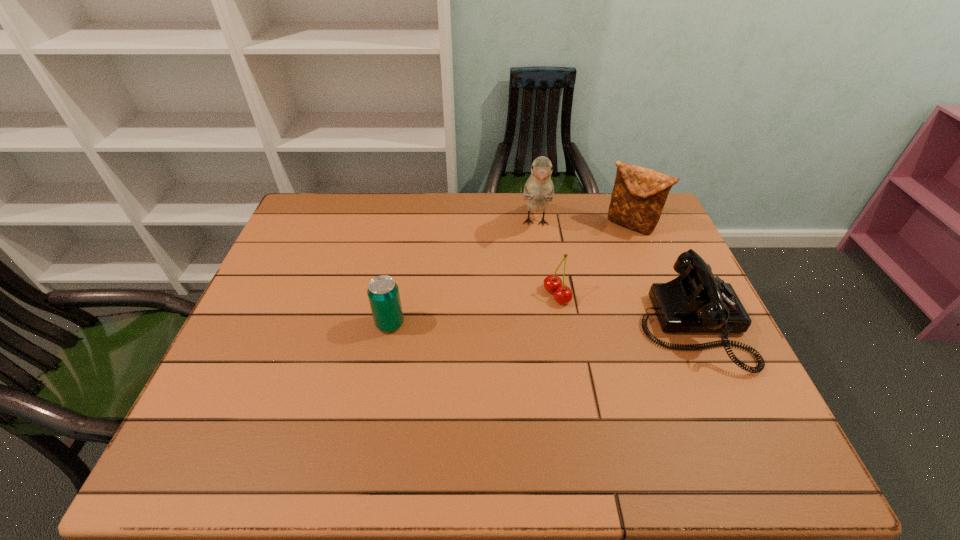
Locate an element on the screen. vacant space located at the face of the tallest object is located at coordinates (537, 255).

What are the coordinates of `vacant space located at the face of the tallest object` in the screenshot? It's located at (535, 299).

This screenshot has width=960, height=540. I want to click on vacant space located with the stems of the cherry pointing upwards, so click(x=452, y=346).

The width and height of the screenshot is (960, 540). In order to click on free space located 0.160m with the stems of the cherry pointing upwards in this screenshot , I will do `click(496, 325)`.

At what (x,y) coordinates should I click in order to perform the action: click on free space located 0.050m with the stems of the cherry pointing upwards. Please return your answer as a coordinate pair (x, y). This screenshot has height=540, width=960. Looking at the image, I should click on (532, 308).

You are a GUI agent. You are given a task and a screenshot of the screen. Output one action in this format:
    pyautogui.click(x=<x>, y=<y>)
    Task: Click on the clutch bag present at the far edge
    The height and width of the screenshot is (540, 960).
    Given the screenshot: What is the action you would take?
    pyautogui.click(x=639, y=194)

Locate an element on the screen. Image resolution: width=960 pixels, height=540 pixels. bird present at the far edge is located at coordinates (539, 190).

The image size is (960, 540). Identify the location of telephone present at the right edge. (696, 301).

Identify the location of clutch bag at the right edge. This screenshot has width=960, height=540. (639, 194).

Image resolution: width=960 pixels, height=540 pixels. Identify the location of object at the far right corner. (639, 194).